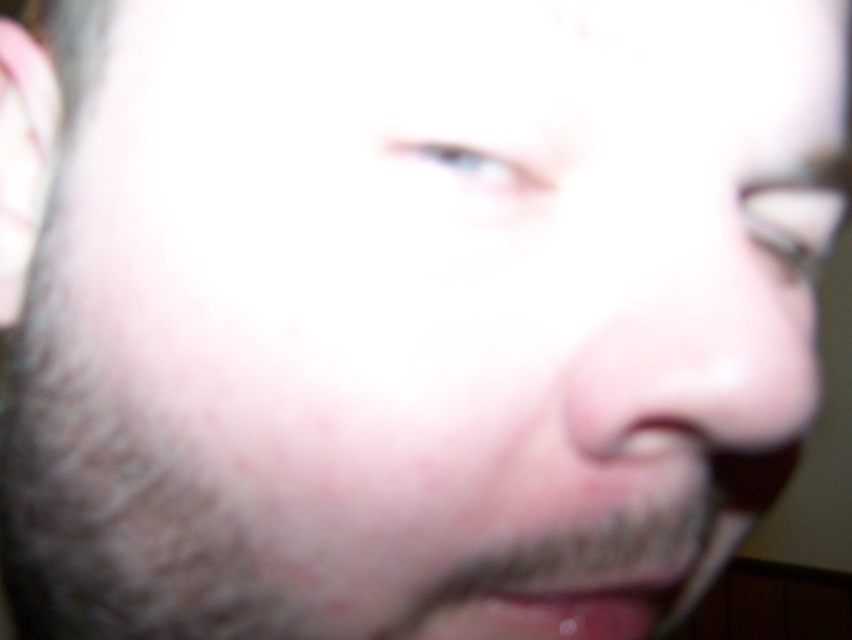
You are a makeup artist preparing to apply contouring to the pink smooth nose at center and the pink glossy lips at lower center. Which of these two features requires a larger contouring product amount due to its size?

The pink smooth nose at center requires a larger contouring product amount because it has a larger size compared to the pink glossy lips at lower center.

You are a makeup artist preparing to apply lipstick. You notice the pink smooth nose at center and the pink glossy lips at lower center. Which feature is positioned closer to your brush when you are applying the lipstick?

The pink smooth nose at center is closer to the viewer than the pink glossy lips at lower center, so the nose would be closer to the brush during application.

You are a makeup artist preparing to apply lipstick. You need to ensure the lipstick is centered between the pink smooth nose at center and the pink glossy lips at lower center. Which object should you use as the reference point to align the lipstick?

The pink glossy lips at lower center should be used as the reference point because the pink smooth nose at center is positioned on the right side of them, so aligning the lipstick with the lips ensures proper centering.